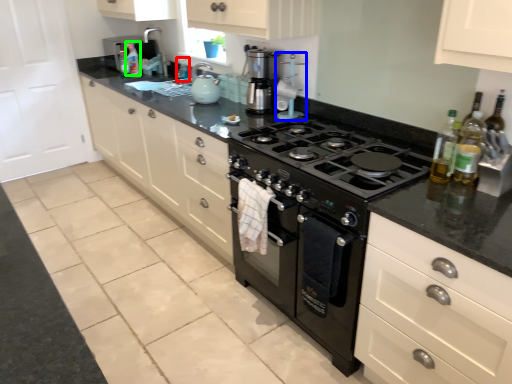
Question: Estimate the real-world distances between objects in this image. Which object is farther from bottle (highlighted by a red box), appliance (highlighted by a blue box) or bottle (highlighted by a green box)?

Choices:
 (A) appliance
 (B) bottle

Answer: (A)